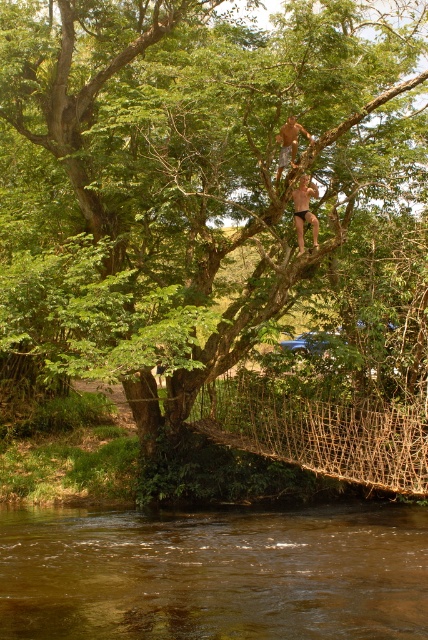
Which is above, brown woven rope bridge at lower center or smooth skin child at upper center?

Positioned higher is smooth skin child at upper center.

Is brown woven rope bridge at lower center wider than smooth skin child at upper center?

No, brown woven rope bridge at lower center is not wider than smooth skin child at upper center.

Between point (397, 452) and point (297, 236), which one is positioned in front?

Point (397, 452) is in front.

Locate an element on the screen. brown woven rope bridge at lower center is located at coordinates (318, 432).

Which is in front, point (394, 406) or point (290, 161)?

Point (290, 161) is in front.

Based on the photo, can you confirm if brown woven rope bridge at lower center is positioned below brown leather belt at upper center?

Correct, brown woven rope bridge at lower center is located below brown leather belt at upper center.

Is point (327, 426) farther from camera compared to point (279, 136)?

Yes, point (327, 426) is farther from viewer.

Identify the location of brown woven rope bridge at lower center. This screenshot has height=640, width=428. (318, 432).

Can you confirm if green leafy tree at upper center is positioned to the right of brown muddy water at lower center?

Yes, green leafy tree at upper center is to the right of brown muddy water at lower center.

The width and height of the screenshot is (428, 640). I want to click on green leafy tree at upper center, so click(183, 173).

Locate an element on the screen. The height and width of the screenshot is (640, 428). green leafy tree at upper center is located at coordinates (183, 173).